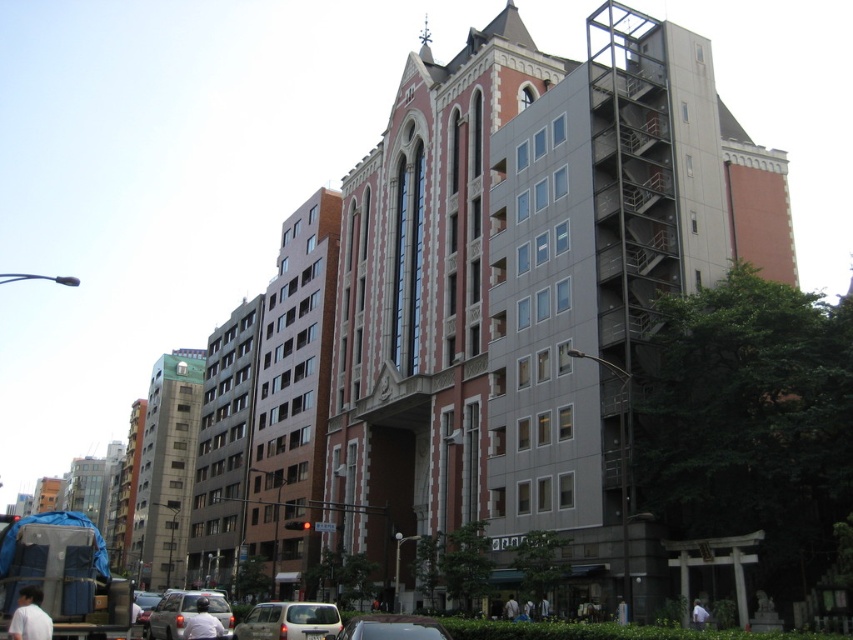
Consider the image. Is matte gray car at lower left smaller than silver metallic car at center?

Indeed, matte gray car at lower left has a smaller size compared to silver metallic car at center.

Can you confirm if matte gray car at lower left is positioned above silver metallic car at center?

Actually, matte gray car at lower left is below silver metallic car at center.

Which is in front, point (190, 602) or point (424, 628)?

Point (424, 628)

The height and width of the screenshot is (640, 853). In order to click on matte gray car at lower left in this screenshot , I will do `click(184, 612)`.

Is metallic gray scaffolding at right below matte gray car at lower left?

No, metallic gray scaffolding at right is not below matte gray car at lower left.

Which is more to the right, metallic gray scaffolding at right or matte gray car at lower left?

metallic gray scaffolding at right is more to the right.

Where is `metallic gray scaffolding at right`? The width and height of the screenshot is (853, 640). metallic gray scaffolding at right is located at coordinates (628, 257).

Does white cotton shirt at lower left have a greater height compared to white cotton shirt at lower right?

Incorrect, white cotton shirt at lower left's height is not larger of white cotton shirt at lower right's.

In the scene shown: Is white cotton shirt at lower left below white cotton shirt at lower right?

Actually, white cotton shirt at lower left is above white cotton shirt at lower right.

Does point (10, 618) come behind point (701, 621)?

That is False.

Where is `white cotton shirt at lower left`? This screenshot has width=853, height=640. white cotton shirt at lower left is located at coordinates (28, 616).